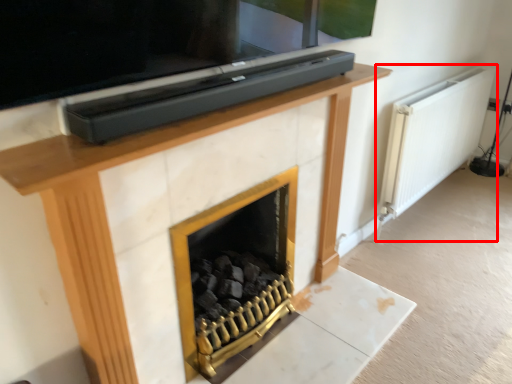
Question: From the image's perspective, what is the correct spatial positioning of radiator (annotated by the red box) in reference to fireplace?

Choices:
 (A) above
 (B) below

Answer: (A)